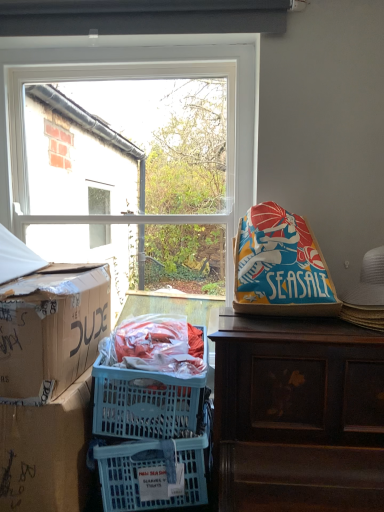
Find the location of a particular element. This screenshot has height=512, width=384. vacant area in front of blue fabric bean bag at right is located at coordinates (283, 332).